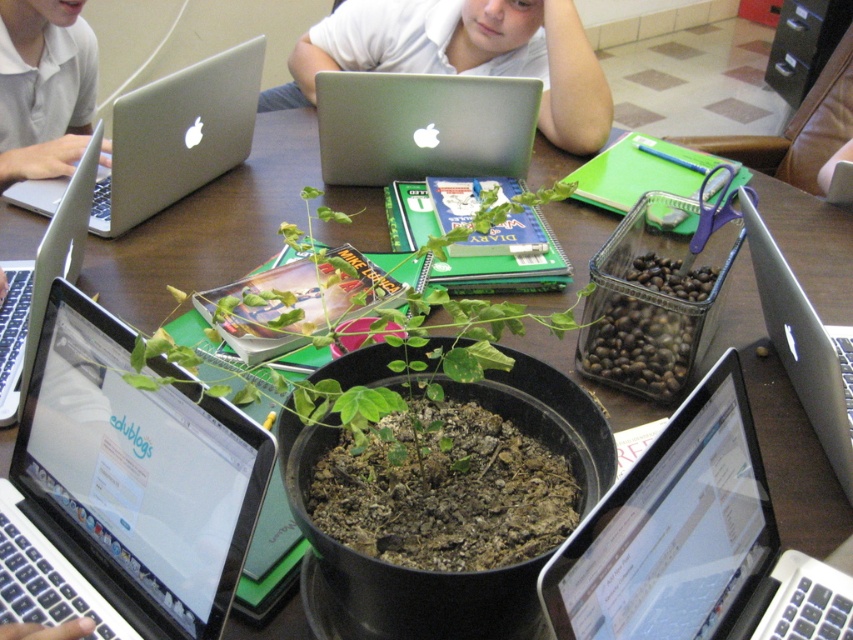
Question: Can you confirm if silver metallic laptop at upper left is positioned to the left of silver metallic laptop at left?

Choices:
 (A) no
 (B) yes

Answer: (A)

Question: Which point is closer to the camera?

Choices:
 (A) silver metallic laptop at right
 (B) white matte shirt at upper left
 (C) silver metallic laptop at lower right
 (D) silver metallic laptop at center

Answer: (C)

Question: Which point is closer to the camera?

Choices:
 (A) silver metallic laptop at center
 (B) white matte shirt at upper center
 (C) silver metallic laptop at upper left

Answer: (A)

Question: Among these objects, which one is farthest from the camera?

Choices:
 (A) white matte shirt at upper left
 (B) white matte shirt at upper center
 (C) silver metallic laptop at lower right

Answer: (B)

Question: Does white matte shirt at upper center have a smaller size compared to silver metallic laptop at upper center?

Choices:
 (A) yes
 (B) no

Answer: (B)

Question: Is silver metallic laptop at center thinner than silver metallic laptop at upper left?

Choices:
 (A) yes
 (B) no

Answer: (A)